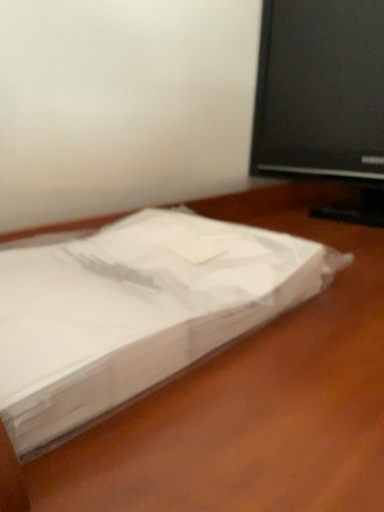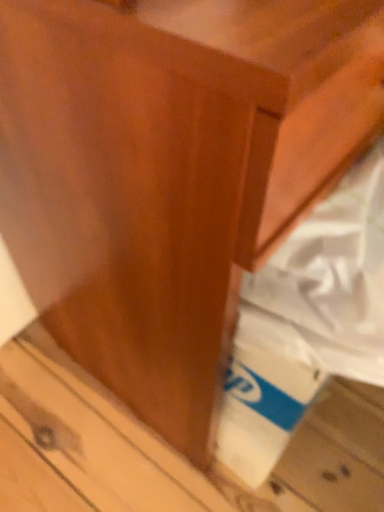
Question: Which way did the camera rotate in the video?

Choices:
 (A) rotated downward
 (B) rotated upward

Answer: (A)